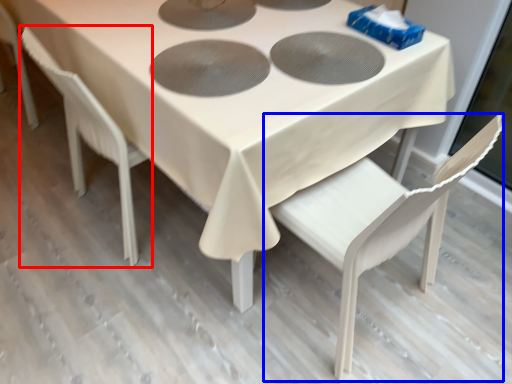
Question: Which object is further to the camera taking this photo, chair (highlighted by a red box) or chair (highlighted by a blue box)?

Choices:
 (A) chair
 (B) chair

Answer: (A)